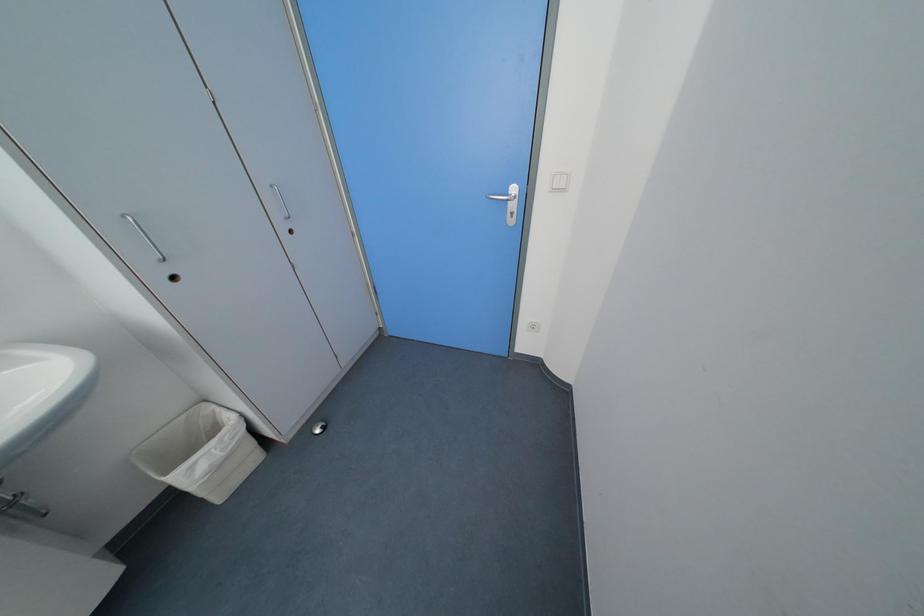
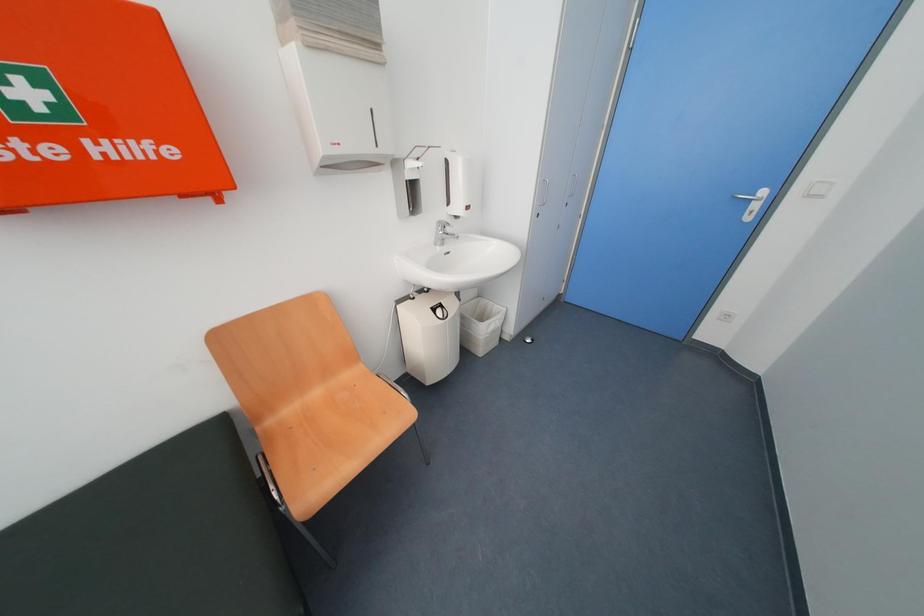
Which direction would the cameraman need to move to produce the second image?

The movement direction of the cameraman is left, backward.